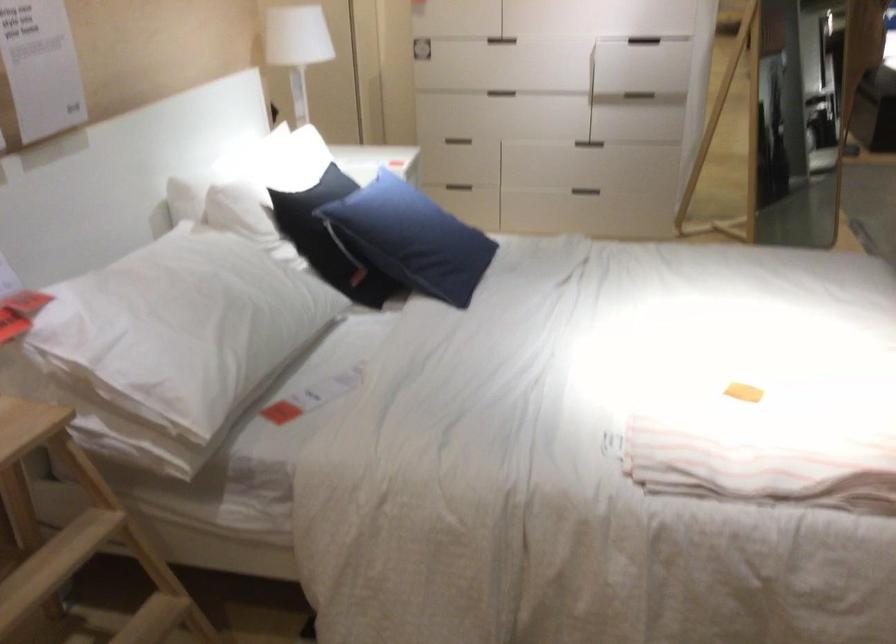
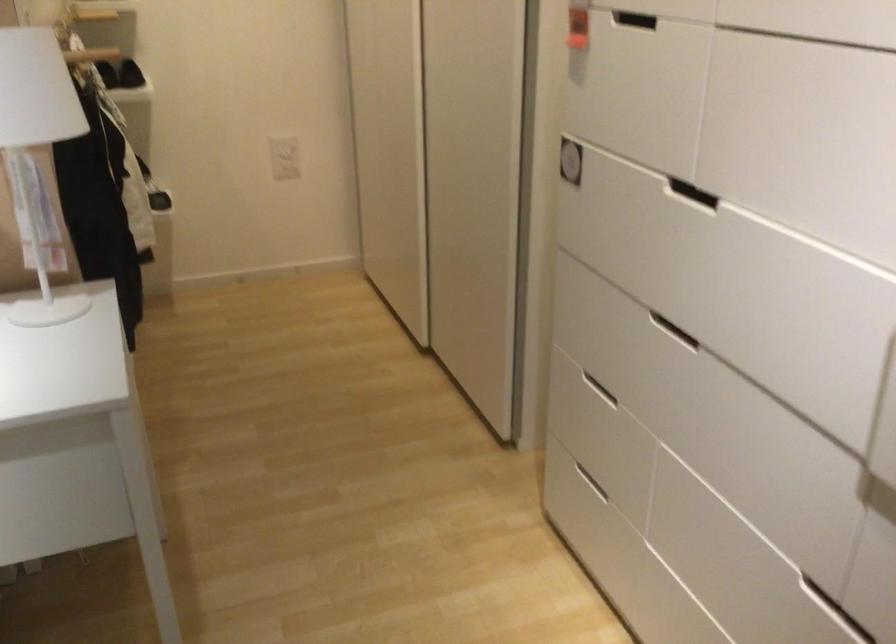
Where in the second image is the point corresponding to [522,84] from the first image?

(673, 330)